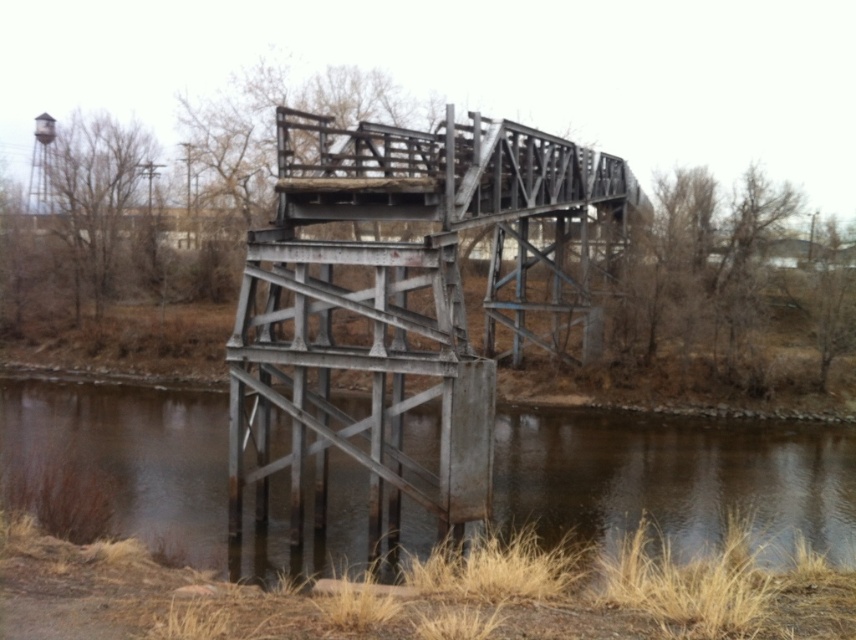
You are standing at the point with coordinates (406, 300) in the image. What object is located exactly at your current position?

The rusty metal bridge at center is located exactly at the point with coordinates (406, 300).